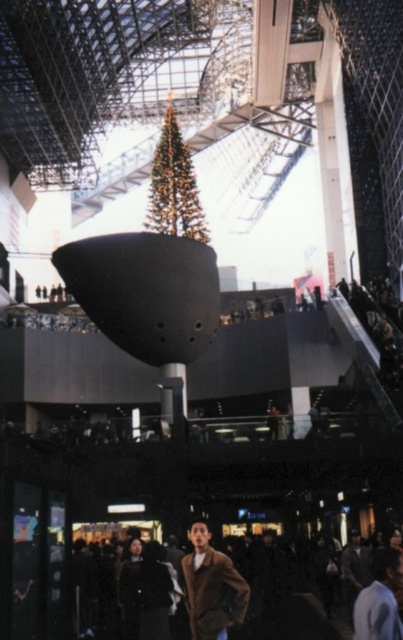
You are a customer in the mall and see the brown wool coat at lower center and the green textured christmas tree at center. Which object is positioned to the right side of the other?

The brown wool coat at lower center is to the right of the green textured christmas tree at center.

You are a delivery person carrying a package that requires a clear path of 50 feet to maneuver safely. You see the brown wool coat at lower center and the dark brown leather jacket at lower center in the scene. Is there enough space between them to move your package safely?

The distance between the brown wool coat at lower center and the dark brown leather jacket at lower center is 45.85 feet. Since the required clear path is 50 feet, there is insufficient space for the package to maneuver safely.

You are standing in the modern building and want to determine the relative positions of two points marked in the image. Which of the two points, point (211, 604) or point (159, 163), is closer to you?

Point (211, 604) is closer to the viewer than point (159, 163).